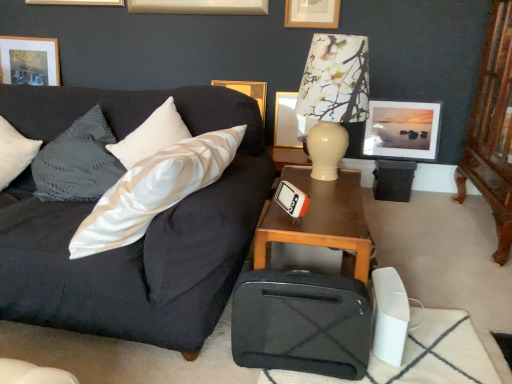
Where is `free space in front of matte cream lampshade at upper right`? The image size is (512, 384). free space in front of matte cream lampshade at upper right is located at coordinates [x=331, y=204].